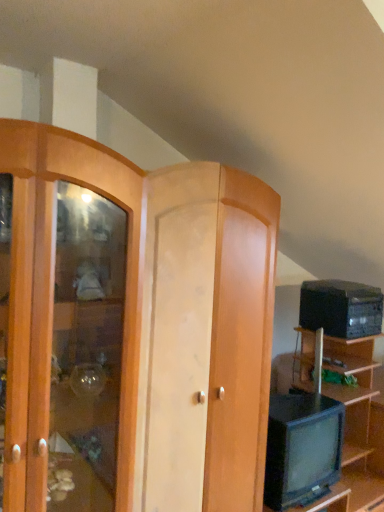
The height and width of the screenshot is (512, 384). Describe the element at coordinates (341, 308) in the screenshot. I see `black plastic speaker at upper right` at that location.

Locate an element on the screen. This screenshot has width=384, height=512. black plastic speaker at upper right is located at coordinates (341, 308).

What is the approximate width of black plastic speaker at upper right?

14.37 inches.

Identify the location of black plastic speaker at upper right. Image resolution: width=384 pixels, height=512 pixels. (341, 308).